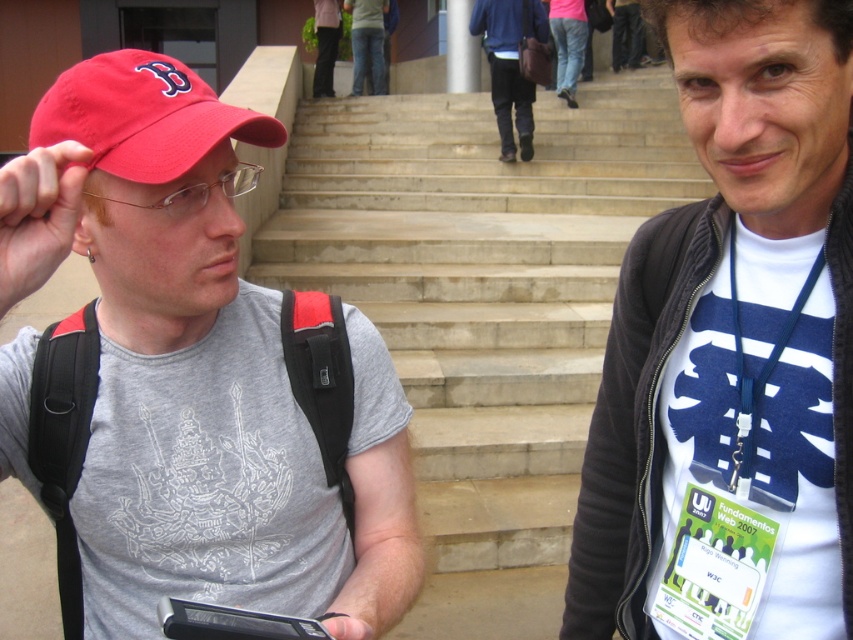
You are a photographer trying to capture a candid shot of the person wearing the matte red baseball cap at left without them noticing. Your camera is currently positioned 33.92 inches away from the cap. Can you take the photo without moving the camera?

Yes, the matte red baseball cap at left and camera are 33.92 inches apart, so you can take the photo without moving the camera since the distance matches the required positioning.